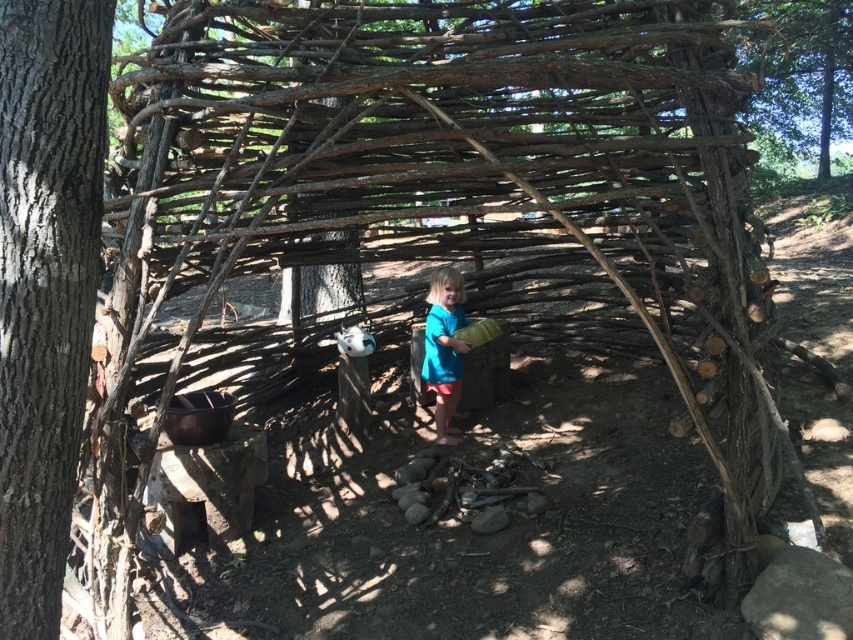
Question: Among these objects, which one is nearest to the camera?

Choices:
 (A) blue fabric at center
 (B) green leafy tree at upper right
 (C) brown rough bark tree at left

Answer: (C)

Question: Considering the real-world distances, which object is closest to the blue fabric at center?

Choices:
 (A) brown rough bark tree at left
 (B) green leafy tree at upper right

Answer: (A)

Question: Among these points, which one is nearest to the camera?

Choices:
 (A) (459, 358)
 (B) (71, 168)

Answer: (B)

Question: Is brown rough bark tree at left to the left of green leafy tree at upper right from the viewer's perspective?

Choices:
 (A) yes
 (B) no

Answer: (A)

Question: Observing the image, what is the correct spatial positioning of brown rough bark tree at left in reference to green leafy tree at upper right?

Choices:
 (A) right
 (B) left

Answer: (B)

Question: In this image, where is green leafy tree at upper right located relative to blue fabric at center?

Choices:
 (A) below
 (B) above

Answer: (B)